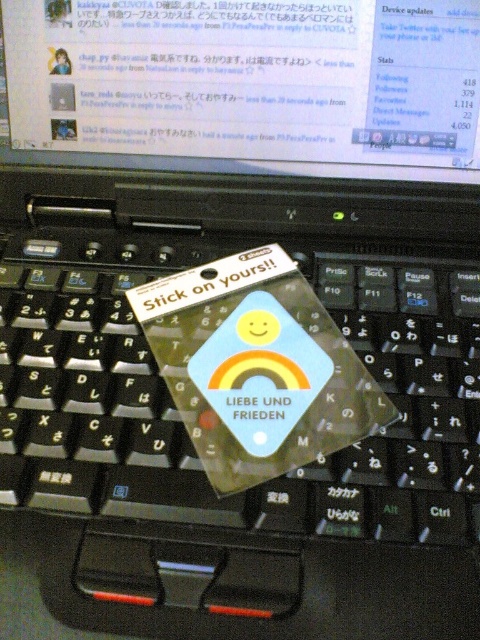
Between black plastic keyboard at center and matte plastic computer screen at upper center, which one has more height?

black plastic keyboard at center is taller.

Between black plastic keyboard at center and matte plastic computer screen at upper center, which one is positioned higher?

matte plastic computer screen at upper center is above.

This screenshot has width=480, height=640. I want to click on black plastic keyboard at center, so click(180, 419).

Find the location of a particular element. This screenshot has height=640, width=480. black plastic keyboard at center is located at coordinates (180, 419).

Does matte plastic computer screen at upper center have a lesser height compared to matte plastic sticker at center?

No, matte plastic computer screen at upper center is not shorter than matte plastic sticker at center.

Is point (433, 68) positioned after point (214, 360)?

Yes, it is behind point (214, 360).

Between point (192, 104) and point (243, 426), which one is positioned behind?

The point (192, 104) is behind.

At what (x,y) coordinates should I click in order to perform the action: click on matte plastic computer screen at upper center. Please return your answer as a coordinate pair (x, y). Looking at the image, I should click on (249, 84).

Does point (117, 392) come behind point (299, 392)?

Yes, it is behind point (299, 392).

Between point (129, 252) and point (256, 349), which one is positioned in front?

Positioned in front is point (256, 349).

Locate an element on the screen. black plastic keyboard at center is located at coordinates (180, 419).